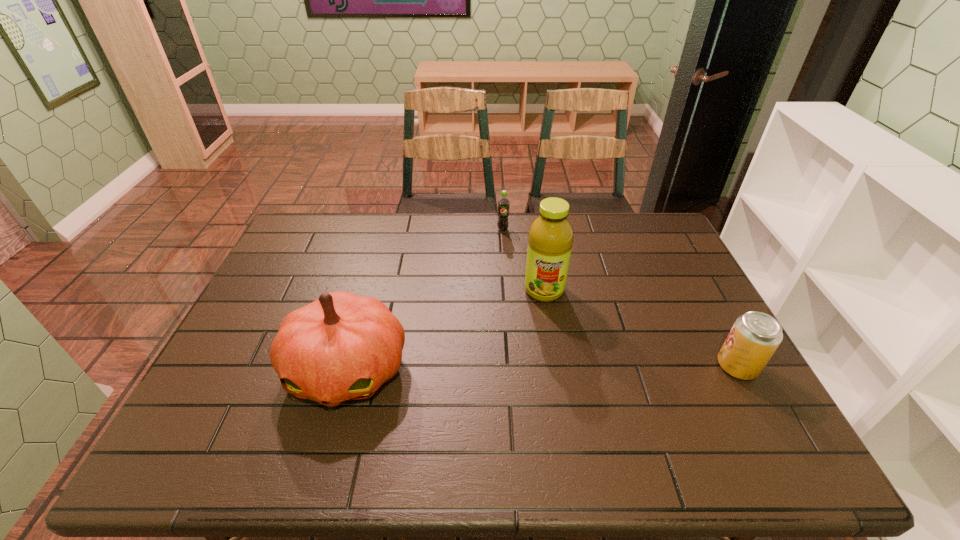
I want to click on vacant area located 0.320m on the front label of the second farthest object, so click(x=540, y=399).

The height and width of the screenshot is (540, 960). In order to click on vacant space situated 0.330m on the front label of the second farthest object in this screenshot , I will do `click(540, 402)`.

The width and height of the screenshot is (960, 540). What are the coordinates of `blank space located on the front label of the second object from left to right` in the screenshot? It's located at (504, 254).

What are the coordinates of `vacant area situated on the front label of the second object from left to right` in the screenshot? It's located at (504, 252).

Locate an element on the screen. free space located on the front label of the second object from left to right is located at coordinates (507, 315).

Locate an element on the screen. object present at the far edge is located at coordinates (503, 203).

Find the location of `object at the near edge`. object at the near edge is located at coordinates (341, 347).

The image size is (960, 540). I want to click on object that is at the right edge, so click(x=755, y=336).

Identify the location of free space at the far edge of the desktop. The width and height of the screenshot is (960, 540). (350, 220).

At what (x,y) coordinates should I click in order to perform the action: click on free region at the near edge of the desktop. Please return your answer as a coordinate pair (x, y). The image size is (960, 540). Looking at the image, I should click on click(x=452, y=410).